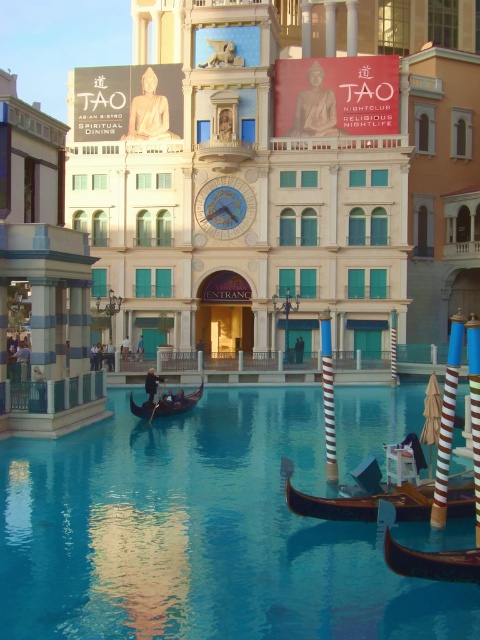
Question: Which of the following is the closest to the observer?

Choices:
 (A) wooden gondola at center
 (B) blue polished water at center
 (C) striped wood pole at right
 (D) dark brown polished wood gondola at center

Answer: (B)

Question: Does striped wood pole at right come in front of dark brown polished wood gondola at center?

Choices:
 (A) yes
 (B) no

Answer: (A)

Question: Can you confirm if striped wood pole at right is thinner than dark brown polished wood gondola at center?

Choices:
 (A) no
 (B) yes

Answer: (A)

Question: Can you confirm if wooden gondola at lower right is positioned below dark brown polished wood gondola at center?

Choices:
 (A) yes
 (B) no

Answer: (A)

Question: Which object appears closest to the camera in this image?

Choices:
 (A) wooden gondola at lower right
 (B) dark brown polished wood gondola at center
 (C) striped wood pole at right

Answer: (A)

Question: Estimate the real-world distances between objects in this image. Which object is closer to the dark brown polished wood gondola at center?

Choices:
 (A) blue polished water at center
 (B) wooden gondola at lower right

Answer: (A)